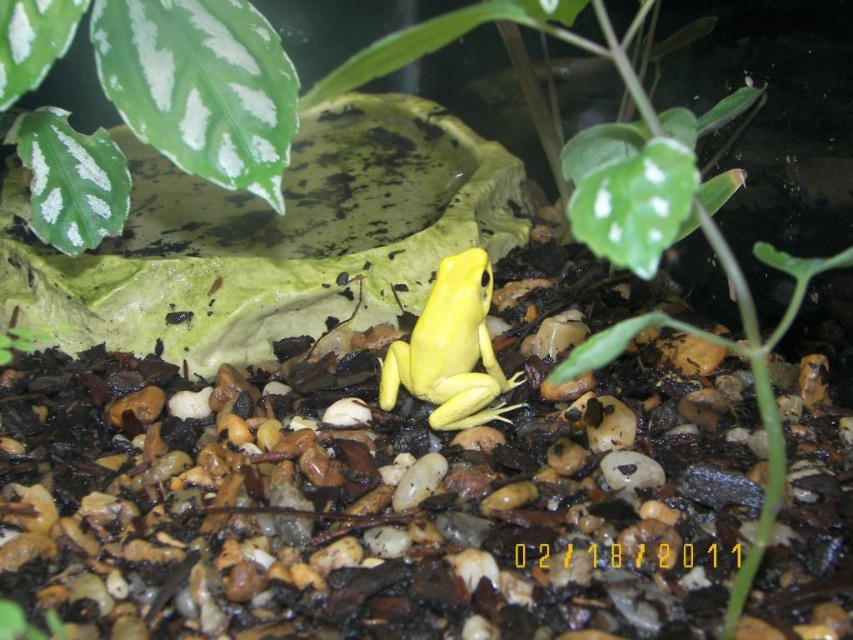
Question: Can you confirm if white matte leaf at upper left is smaller than yellow matte/skinny frog at center?

Choices:
 (A) no
 (B) yes

Answer: (B)

Question: Does white matte leaf at upper left appear on the left side of yellow matte/skinny frog at center?

Choices:
 (A) no
 (B) yes

Answer: (B)

Question: Can you confirm if white matte leaf at upper left is bigger than yellow matte/skinny frog at center?

Choices:
 (A) yes
 (B) no

Answer: (B)

Question: Which object is farther from the camera taking this photo?

Choices:
 (A) white matte leaf at upper left
 (B) yellow matte/skinny frog at center

Answer: (B)

Question: Which point appears closest to the camera in this image?

Choices:
 (A) (445, 257)
 (B) (241, 120)

Answer: (B)